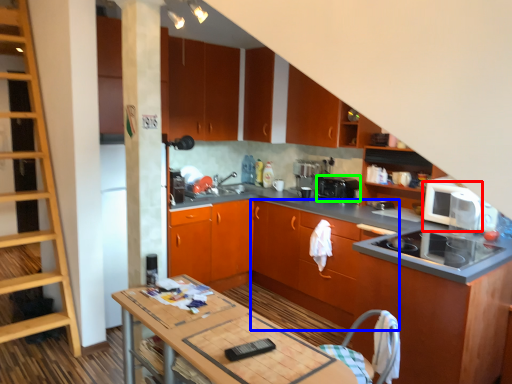
Question: Which object is positioned closest to home appliance (highlighted by a red box)? Select from cabinetry (highlighted by a blue box) and kitchen appliance (highlighted by a green box).

Choices:
 (A) cabinetry
 (B) kitchen appliance

Answer: (B)